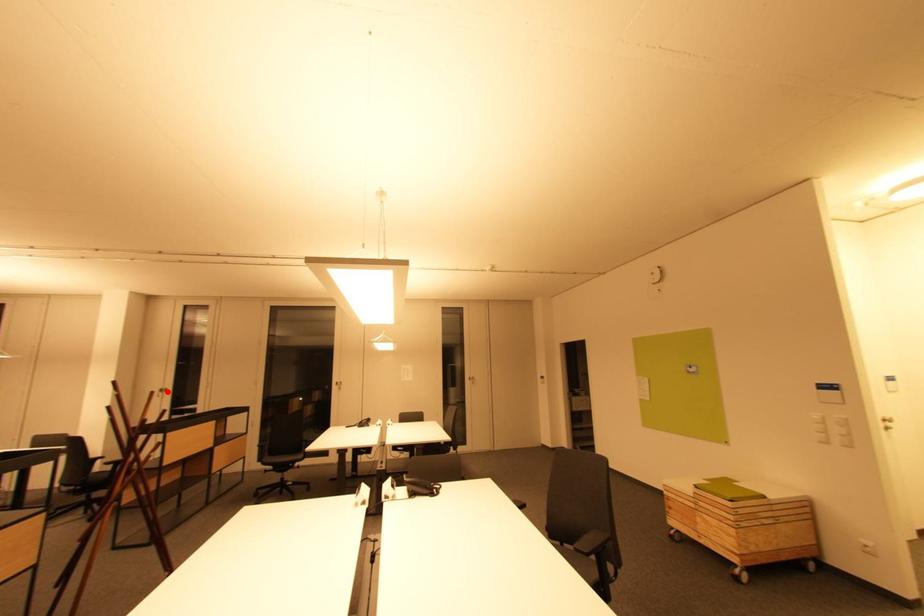
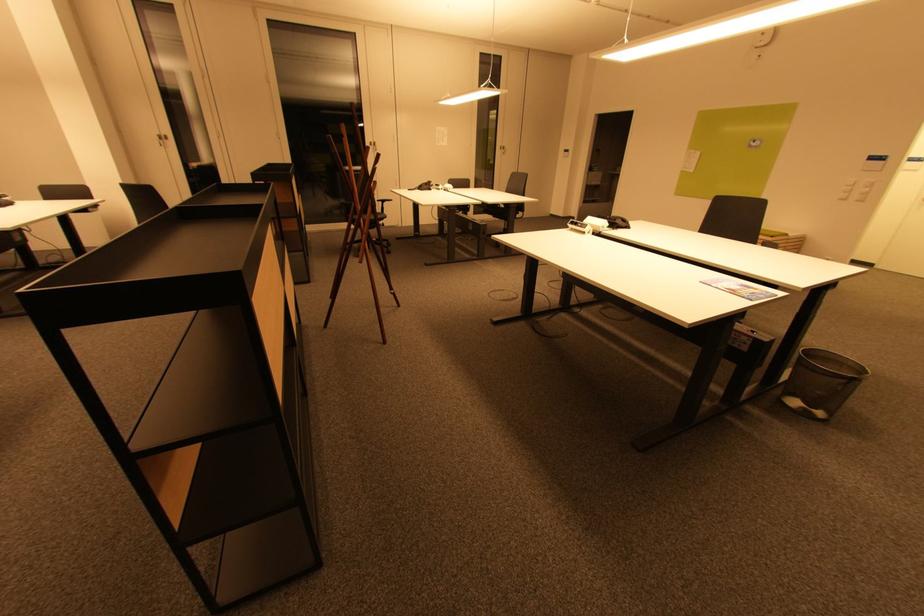
Locate, in the second image, the point that corresponds to the highlighted location in the first image.

(166, 140)